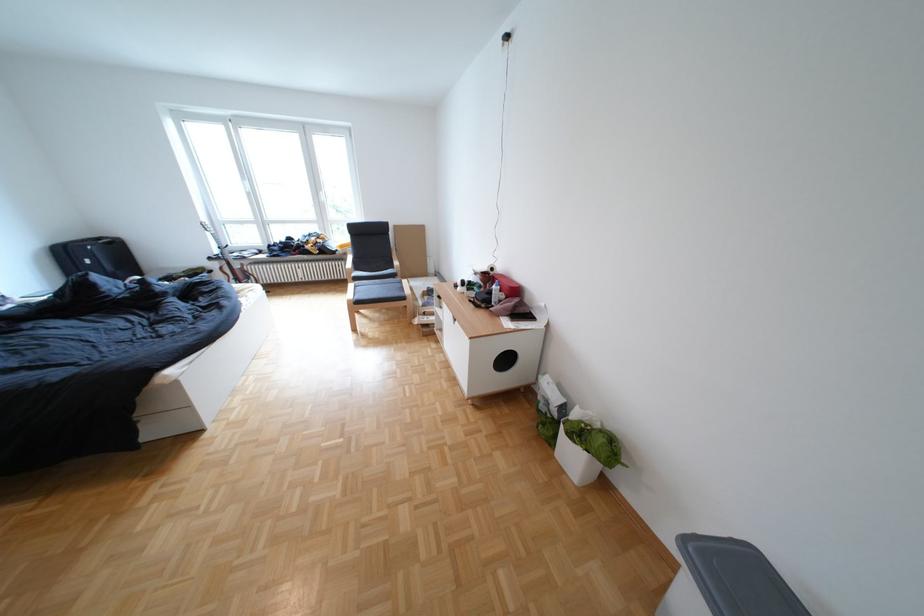
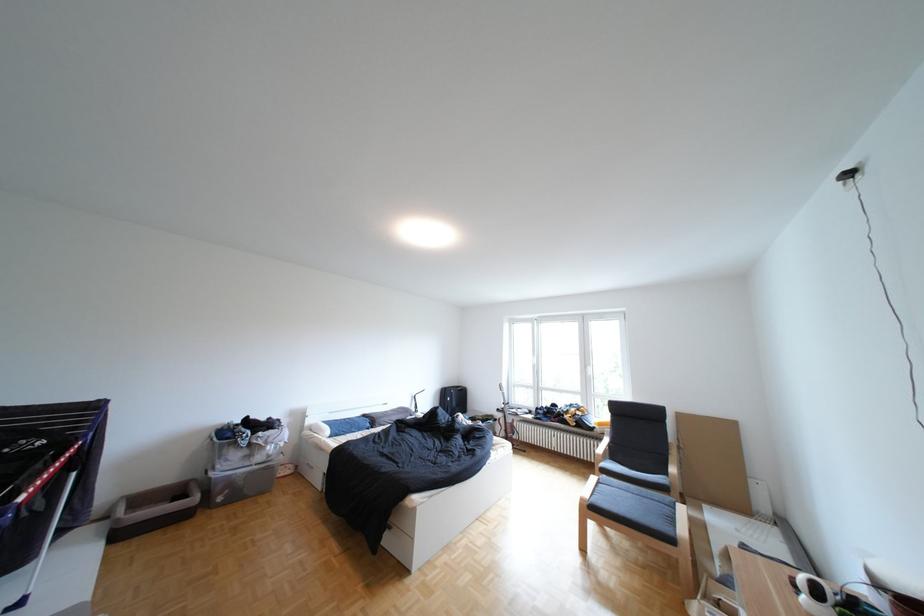
Locate, in the second image, the point that corresponds to point 479,283 in the first image.

(832, 591)